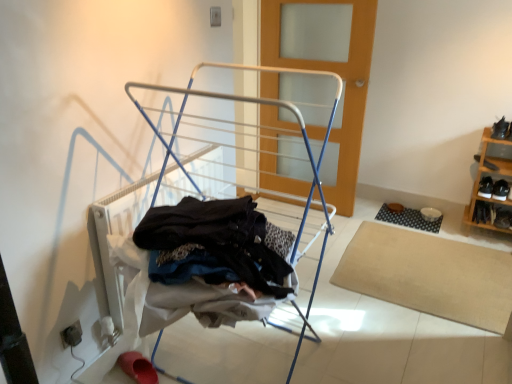
Identify the location of free space in front of black rubber mat at lower right, which ranks as the second mat in front-to-back order. (421, 234).